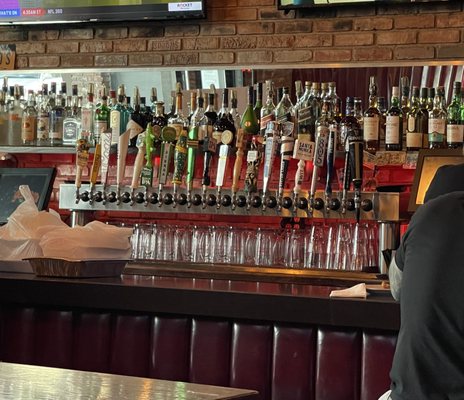
At what (x,y) coordinates should I click in order to perform the action: click on different booze bottles on shelf. Please return your answer as a coordinate pair (x, y). Looking at the image, I should click on (74, 124), (137, 116), (217, 112), (394, 111).